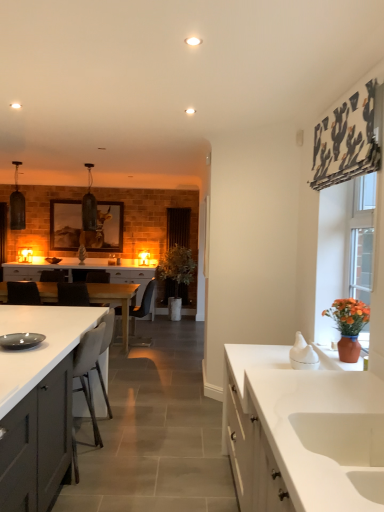
Question: Can you confirm if white glossy cabinet at center, the first cabinetry positioned from the back, is positioned to the right of black leather chair at center, which ranks as the 2th chair in front-to-back order?

Choices:
 (A) no
 (B) yes

Answer: (A)

Question: Is white glossy cabinet at center, arranged as the 2th cabinetry when viewed from the front, not near black leather chair at center, which ranks as the 2th chair in front-to-back order?

Choices:
 (A) yes
 (B) no

Answer: (B)

Question: Is white glossy cabinet at center, arranged as the 2th cabinetry when viewed from the front, outside black leather chair at center, marked as the 2th chair in a right-to-left arrangement?

Choices:
 (A) no
 (B) yes

Answer: (B)

Question: From a real-world perspective, is white glossy cabinet at center, arranged as the 2th cabinetry when viewed from the front, beneath black leather chair at center, placed as the third chair when sorted from back to front?

Choices:
 (A) yes
 (B) no

Answer: (B)

Question: Could you tell me if white glossy cabinet at center, the first cabinetry positioned from the back, is facing black leather chair at center, marked as the 2th chair in a right-to-left arrangement?

Choices:
 (A) yes
 (B) no

Answer: (A)

Question: From a real-world perspective, is matte gray cabinets at lower left, which appears as the first cabinetry when viewed from the front, positioned above or below white glossy table at center?

Choices:
 (A) below
 (B) above

Answer: (B)

Question: Is point (31, 317) positioned closer to the camera than point (110, 298)?

Choices:
 (A) closer
 (B) farther

Answer: (A)

Question: Considering the relative positions of matte gray cabinets at lower left, the second cabinetry positioned from the back, and white glossy table at center in the image provided, is matte gray cabinets at lower left, the second cabinetry positioned from the back, to the left or to the right of white glossy table at center?

Choices:
 (A) right
 (B) left

Answer: (A)

Question: Considering the positions of matte gray cabinets at lower left, the second cabinetry positioned from the back, and white glossy table at center in the image, is matte gray cabinets at lower left, the second cabinetry positioned from the back, bigger or smaller than white glossy table at center?

Choices:
 (A) small
 (B) big

Answer: (B)

Question: From the image's perspective, is clear glass door at right located above or below terracotta clay vase at right?

Choices:
 (A) below
 (B) above

Answer: (B)

Question: Which is correct: clear glass door at right is inside terracotta clay vase at right, or outside of it?

Choices:
 (A) outside
 (B) inside

Answer: (A)

Question: Based on their sizes in the image, would you say clear glass door at right is bigger or smaller than terracotta clay vase at right?

Choices:
 (A) small
 (B) big

Answer: (B)

Question: Looking at their shapes, would you say clear glass door at right is wider or thinner than terracotta clay vase at right?

Choices:
 (A) thin
 (B) wide

Answer: (A)

Question: Is white glossy sink at lower right to the left or to the right of white glossy cabinet at center, the first cabinetry positioned from the back, in the image?

Choices:
 (A) right
 (B) left

Answer: (A)

Question: Considering the positions of point (382, 492) and point (150, 278), is point (382, 492) closer or farther from the camera than point (150, 278)?

Choices:
 (A) farther
 (B) closer

Answer: (B)